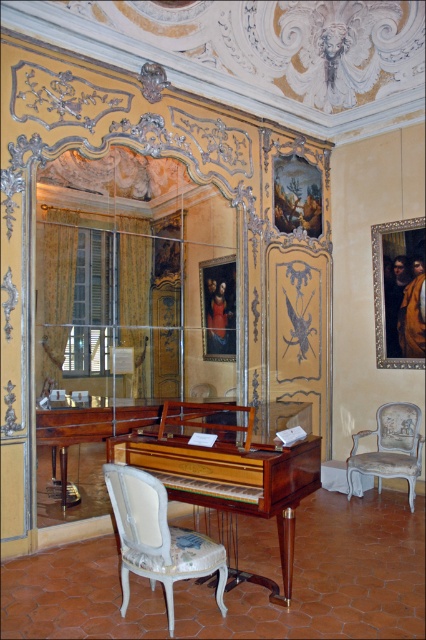
You are a tour guide leading visitors through this historical room. You want to ensure that the distance between the mahogany polished piano at center and the white upholstered armchair at lower left is sufficient for visitors to walk comfortably between them. According to standard guidelines, a comfortable walking path should be at least 24 inches wide. Can the visitors walk comfortably between these two objects?

The mahogany polished piano at center and the white upholstered armchair at lower left are 21.98 inches apart, which is less than the required 24 inches for a comfortable walking path. Therefore, visitors may find the space between them a bit cramped.

You are standing in the room and want to place a new decorative item exactly at the center of the room. Given the location of the mahogany polished piano at center, can you determine if the piano is already at the center?

The 2D location of the mahogany polished piano at center is at point (227,472), which is not exactly the center of the room. Therefore, the piano is not at the center, so you can place the new decorative item there.

You are standing at the entrance of the room and want to sit in the white upholstered armchair at lower left. According to the room layout, what are the coordinates of the armchair?

The white upholstered armchair at lower left is located at coordinates point (158, 538).